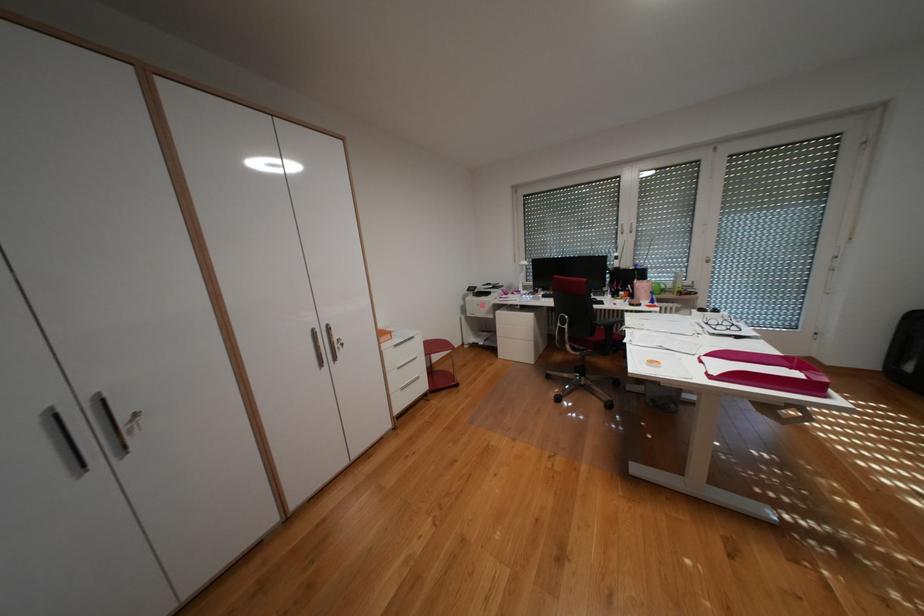
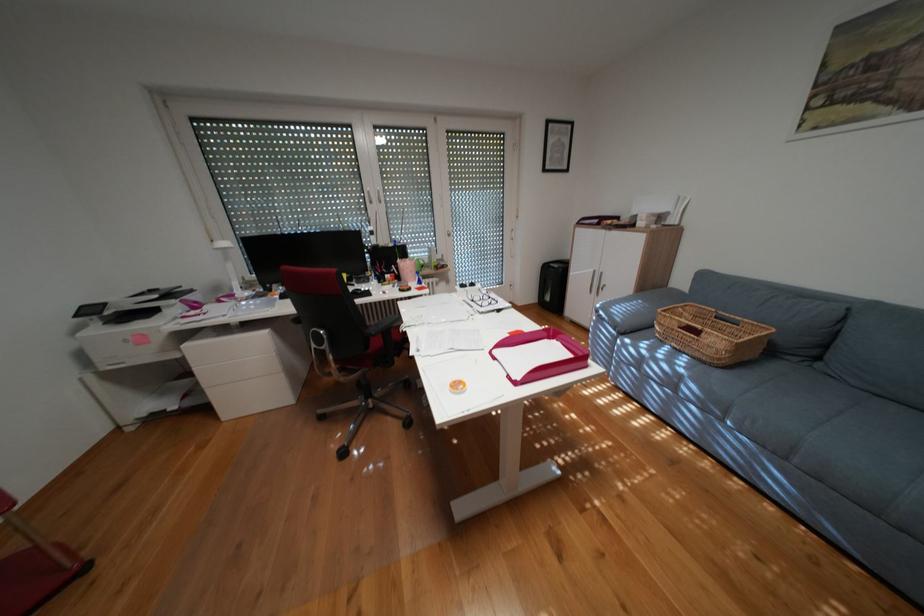
Question: The camera is either moving clockwise (left) or counter-clockwise (right) around the object. The first image is from the beginning of the video and the second image is from the end. Is the camera moving left or right when shooting the video?

Choices:
 (A) Left
 (B) Right

Answer: (A)